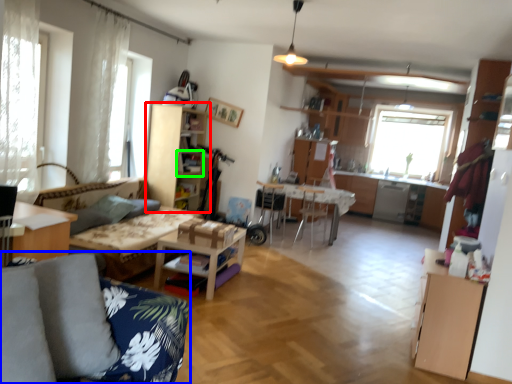
Question: Which object is positioned farthest from cabinetry (highlighted by a red box)? Select from studio couch (highlighted by a blue box) and shelf (highlighted by a green box).

Choices:
 (A) studio couch
 (B) shelf

Answer: (A)